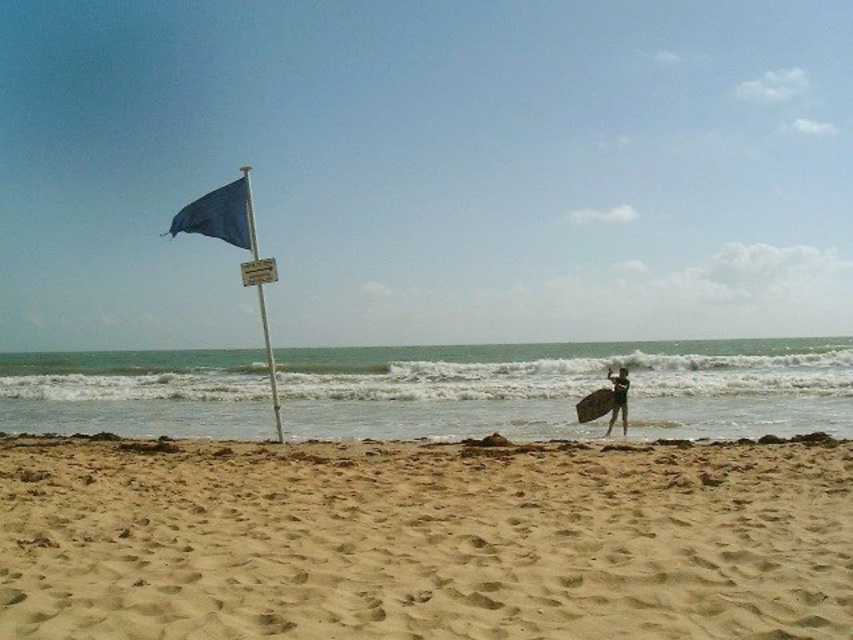
Question: Which object is farther from the camera taking this photo?

Choices:
 (A) brown wooden surfboard at right
 (B) blue fabric flagpole at left
 (C) fine-grained sand at lower center

Answer: (A)

Question: Can you confirm if fine-grained sand at lower center is positioned to the left of black matte surfboard at right?

Choices:
 (A) yes
 (B) no

Answer: (A)

Question: Is fine-grained sand at lower center closer to the viewer compared to blue fabric flagpole at left?

Choices:
 (A) no
 (B) yes

Answer: (B)

Question: Which of the following is the closest to the observer?

Choices:
 (A) brown wooden surfboard at right
 (B) fine-grained sand at lower center
 (C) blue fabric flagpole at left
 (D) black matte surfboard at right

Answer: (B)

Question: Is fine-grained sand at lower center bigger than blue fabric flagpole at left?

Choices:
 (A) no
 (B) yes

Answer: (A)

Question: Which point is closer to the camera?

Choices:
 (A) (611, 417)
 (B) (338, 483)
 (C) (585, 400)

Answer: (B)